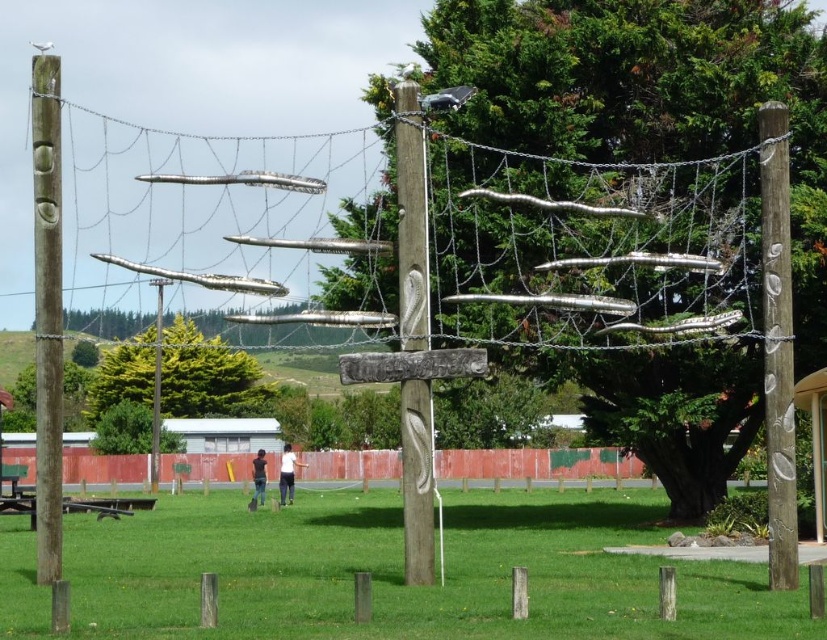
You are an artist planning to photograph the wooden carving at center and the green leafy tree at center from a position where both are visible. Based on their sizes, which object should you focus on first to ensure it fills the frame adequately?

The wooden carving at center has a greater height compared to the green leafy tree at center, so you should focus on the wooden carving at center first to ensure it fills the frame adequately.

You are standing in the park and see the green leafy tree at center and the white cotton shirt at center. Which object is wider?

The green leafy tree at center is wider than the white cotton shirt at center.

You are standing in the park and see the green wood tree at center and the green grass at center. Which object is positioned to the right of the other?

The green wood tree at center is to the right of the green grass at center.